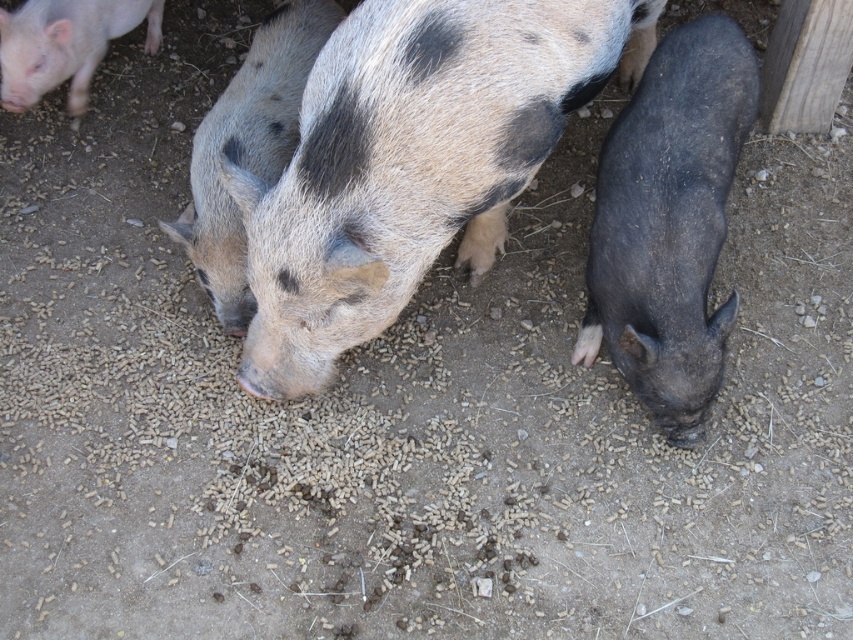
Question: Among these points, which one is farthest from the camera?

Choices:
 (A) (619, 259)
 (B) (265, 40)
 (C) (27, 97)

Answer: (C)

Question: Among these objects, which one is farthest from the camera?

Choices:
 (A) matte pink piglet at upper left
 (B) shiny black piglet at right
 (C) speckled fur pig at center

Answer: (A)

Question: Which object is farther from the camera taking this photo?

Choices:
 (A) matte pink piglet at upper left
 (B) speckled fur pig at center
 (C) speckled fur piglet at center
 (D) shiny black piglet at right

Answer: (A)

Question: Observing the image, what is the correct spatial positioning of shiny black piglet at right in reference to matte pink piglet at upper left?

Choices:
 (A) below
 (B) above

Answer: (A)

Question: Does speckled fur pig at center lie in front of shiny black piglet at right?

Choices:
 (A) yes
 (B) no

Answer: (A)

Question: Can you confirm if speckled fur pig at center is wider than shiny black piglet at right?

Choices:
 (A) yes
 (B) no

Answer: (A)